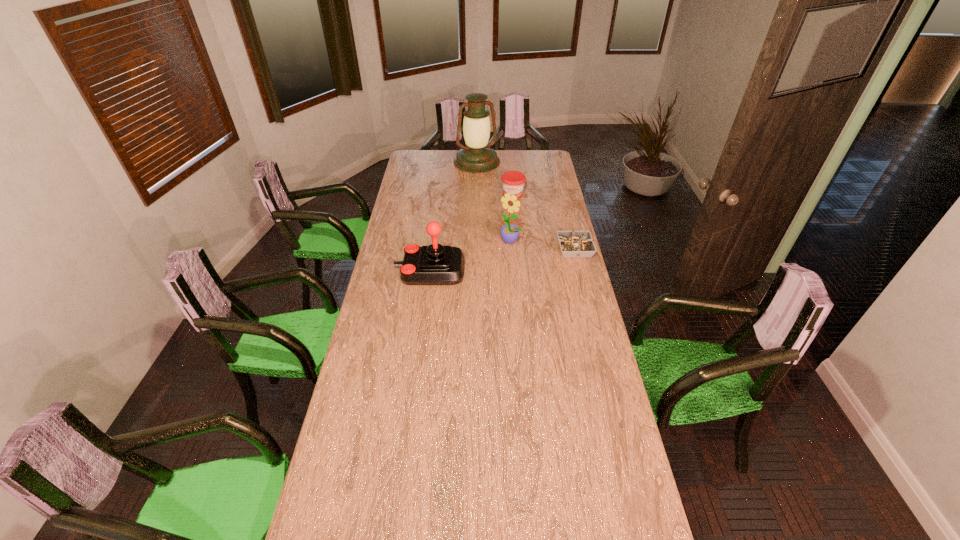
I want to click on free space located on the back of the rightmost object, so click(x=563, y=200).

This screenshot has width=960, height=540. What are the coordinates of `vacant space located 0.180m with the light compartment facing forward on the lantern` in the screenshot? It's located at (489, 188).

The width and height of the screenshot is (960, 540). Find the location of `vacant position located with the light compartment facing forward on the lantern`. vacant position located with the light compartment facing forward on the lantern is located at coordinates (487, 184).

Identify the location of free space located 0.280m with the light compartment facing forward on the lantern. (492, 197).

Find the location of a particular element. The image size is (960, 540). free region located on the front-facing side of the sunflower is located at coordinates (470, 282).

Image resolution: width=960 pixels, height=540 pixels. I want to click on vacant space located on the front-facing side of the sunflower, so click(468, 285).

Where is `free region located on the front-facing side of the sunflower`? free region located on the front-facing side of the sunflower is located at coordinates (478, 274).

Where is `vacant space located 0.230m on the label side of the jam`? The width and height of the screenshot is (960, 540). vacant space located 0.230m on the label side of the jam is located at coordinates (510, 224).

Locate an element on the screen. vacant space located 0.070m on the label side of the jam is located at coordinates (512, 207).

Where is `free space located 0.170m on the label side of the jam`? The image size is (960, 540). free space located 0.170m on the label side of the jam is located at coordinates (510, 218).